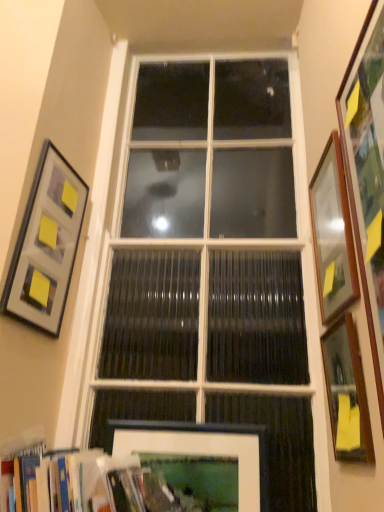
Identify the location of free space above white glass window at center (from a real-world perspective). (213, 45).